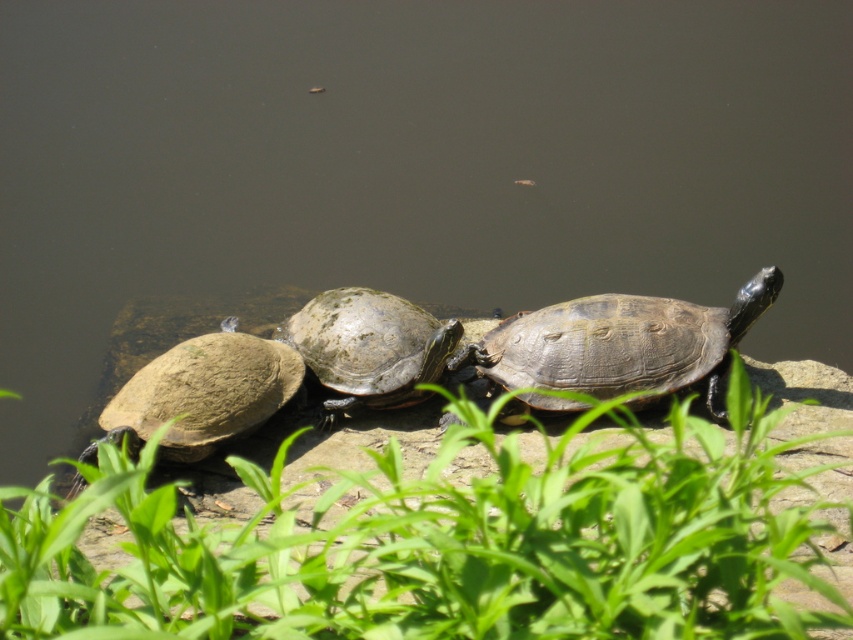
You are a small frog trying to jump from a lily pad to the shiny dark brown tortoise at center. There is green leafy grass at center in between. Can you safely jump over the grass to land on the tortoise?

The green leafy grass at center is closer to the viewer than the shiny dark brown tortoise at center, so the frog can safely jump over the grass to land on the tortoise since the tortoise is further away.